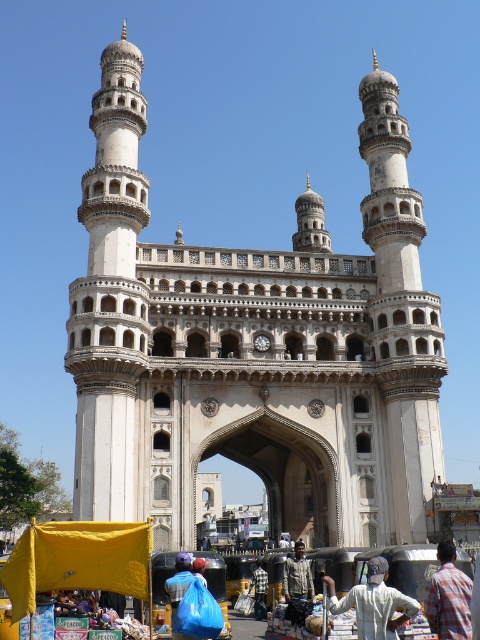
Question: Which point is farther to the camera?

Choices:
 (A) white cotton shirt at center
 (B) white stone tower at center
 (C) dark gray textured shirt at center
 (D) plaid fabric shirt at lower right

Answer: (B)

Question: Which object is the farthest from the plaid fabric shirt at lower right?

Choices:
 (A) dark gray textured shirt at center
 (B) plaid fabric shirt at center

Answer: (B)

Question: Among these points, which one is nearest to the camera?

Choices:
 (A) (367, 596)
 (B) (403, 406)
 (C) (310, 580)

Answer: (A)

Question: Can you confirm if white stone tower at center is positioned to the right of plaid fabric shirt at center?

Choices:
 (A) yes
 (B) no

Answer: (B)

Question: Can you confirm if plaid fabric shirt at lower right is positioned above dark gray textured shirt at center?

Choices:
 (A) yes
 (B) no

Answer: (A)

Question: Is dark gray textured shirt at center above plaid fabric shirt at center?

Choices:
 (A) no
 (B) yes

Answer: (B)